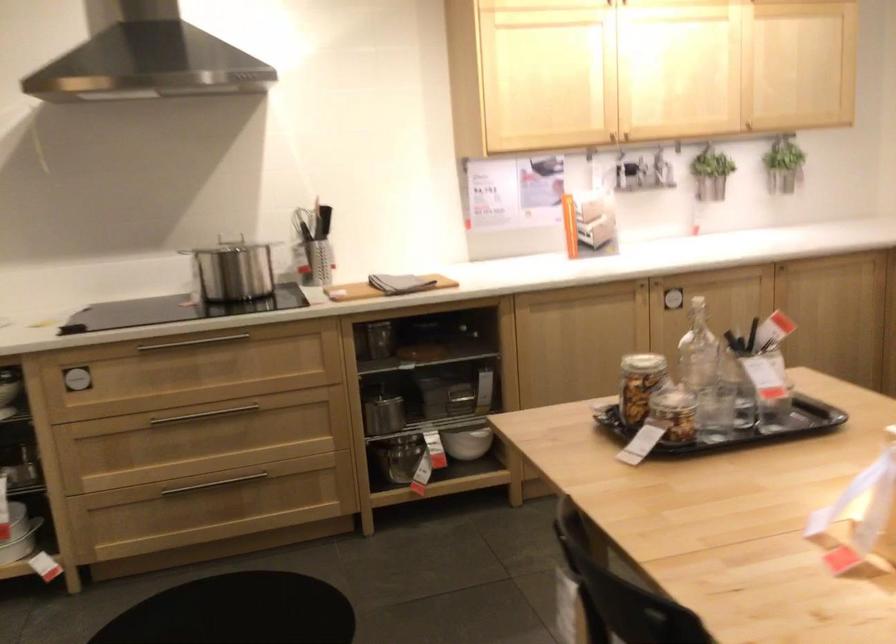
Identify the location of white bowl. (467, 442).